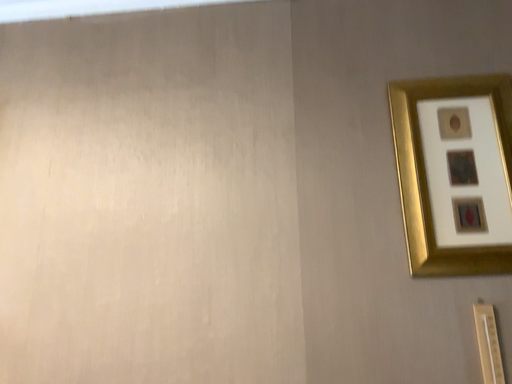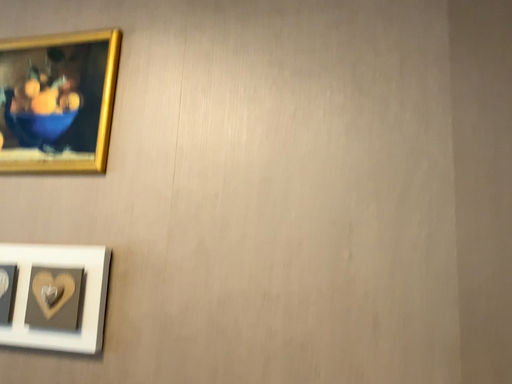
Question: How did the camera likely rotate when shooting the video?

Choices:
 (A) rotated upward
 (B) rotated downward

Answer: (B)